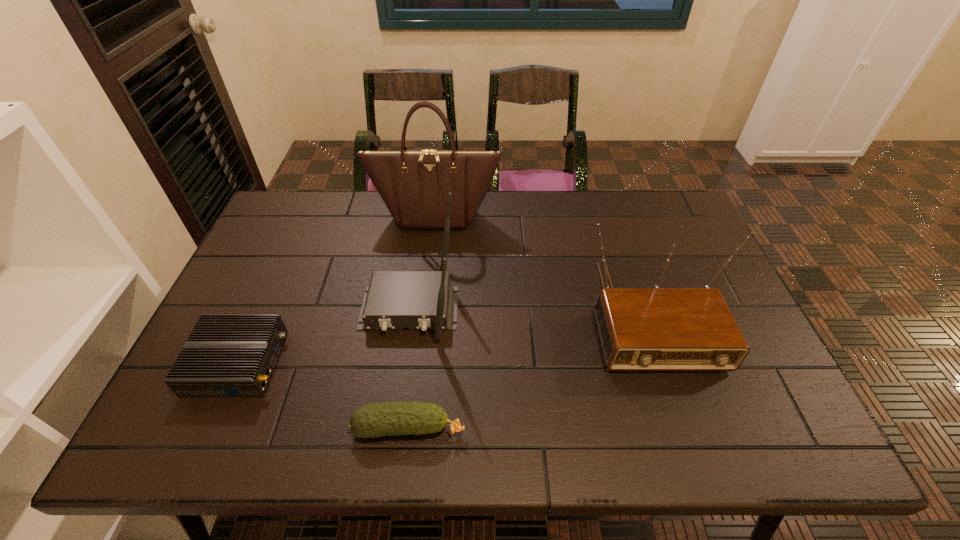
Select which object is the closest to the farthest object. Please provide its 2D coordinates. Your answer should be formatted as a tuple, i.e. [(x, y)], where the tuple contains the x and y coordinates of a point satisfying the conditions above.

[(419, 300)]

Point out which object is positioned as the third nearest to the cucumber. Please provide its 2D coordinates. Your answer should be formatted as a tuple, i.e. [(x, y)], where the tuple contains the x and y coordinates of a point satisfying the conditions above.

[(641, 329)]

Identify the location of free space that satisfies the following two spatial constraints: 1. on the front-facing side of the tallest object; 2. on the back panel of the shorter router. The width and height of the screenshot is (960, 540). (419, 362).

Locate an element on the screen. The image size is (960, 540). free space that satisfies the following two spatial constraints: 1. on the front-facing side of the handbag; 2. on the back panel of the left router is located at coordinates (419, 362).

Locate an element on the screen. free spot that satisfies the following two spatial constraints: 1. on the front-facing side of the tallest object; 2. at the blossom end of the cucumber is located at coordinates (411, 428).

Where is `vacant space that satisfies the following two spatial constraints: 1. on the front-facing side of the handbag; 2. on the back panel of the left router`? Image resolution: width=960 pixels, height=540 pixels. vacant space that satisfies the following two spatial constraints: 1. on the front-facing side of the handbag; 2. on the back panel of the left router is located at coordinates (419, 362).

Locate an element on the screen. This screenshot has width=960, height=540. free space in the image that satisfies the following two spatial constraints: 1. on the front-facing side of the handbag; 2. on the back panel of the left router is located at coordinates (419, 362).